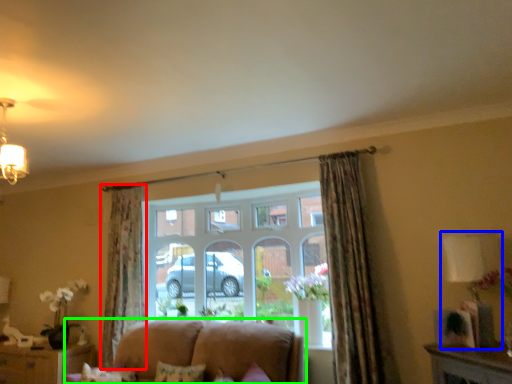
Question: Which object is positioned closest to curtain (highlighted by a red box)? Select from lamp (highlighted by a blue box) and studio couch (highlighted by a green box).

Choices:
 (A) lamp
 (B) studio couch

Answer: (B)